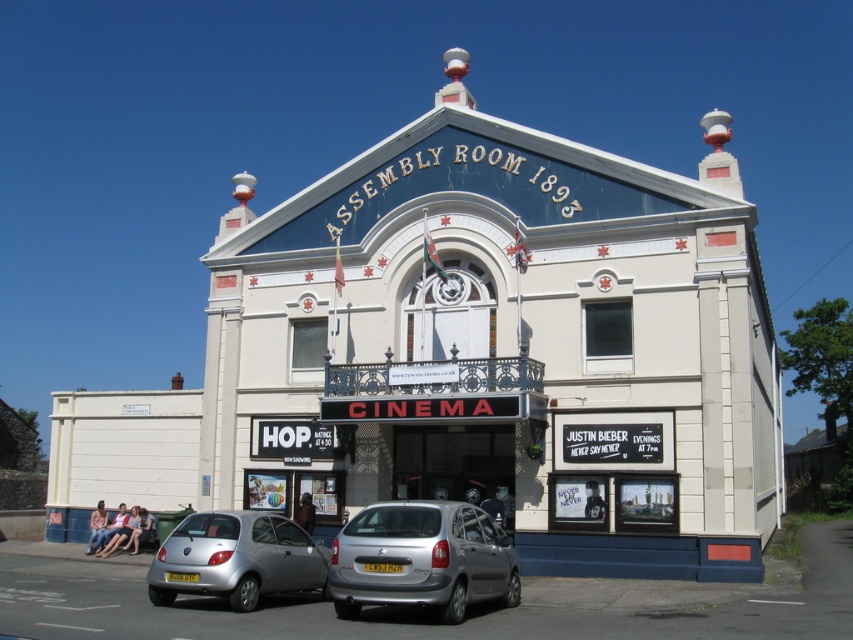
Question: Is silver metallic hatchback at lower center behind silver metallic car at lower left?

Choices:
 (A) no
 (B) yes

Answer: (A)

Question: Which object is farther from the camera taking this photo?

Choices:
 (A) silver metallic car at lower left
 (B) silver metallic hatchback at lower center

Answer: (A)

Question: Where is silver metallic hatchback at lower center located in relation to silver metallic car at lower left in the image?

Choices:
 (A) below
 (B) above

Answer: (B)

Question: In this image, where is silver metallic hatchback at lower center located relative to silver metallic car at lower left?

Choices:
 (A) above
 (B) below

Answer: (A)

Question: Which point is closer to the camera?

Choices:
 (A) silver metallic hatchback at lower center
 (B) silver metallic car at lower left

Answer: (A)